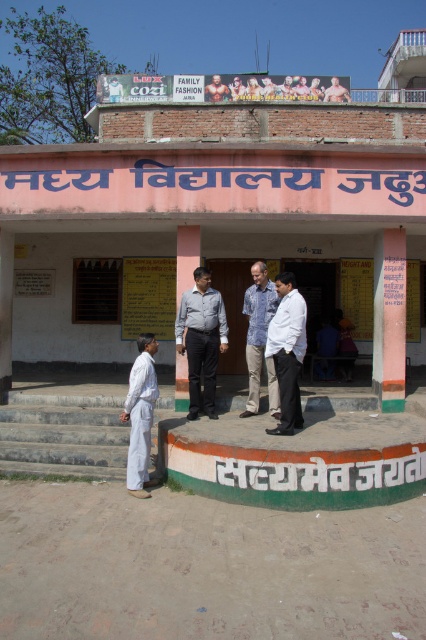
Question: Among these points, which one is farthest from the camera?

Choices:
 (A) (2, 170)
 (B) (146, 364)
 (C) (176, 394)
 (D) (261, 292)

Answer: (A)

Question: Can you confirm if orange painted pillar at right is positioned to the left of blue cotton shirt at center?

Choices:
 (A) no
 (B) yes

Answer: (A)

Question: Does light gray shirt at center appear on the right side of white cotton shirt at lower left?

Choices:
 (A) yes
 (B) no

Answer: (A)

Question: Which point appears farthest from the camera in this image?

Choices:
 (A) (278, 308)
 (B) (181, 342)
 (C) (270, 388)
 (D) (400, 227)

Answer: (D)

Question: Which of the following is the closest to the observer?

Choices:
 (A) (94, 252)
 (B) (132, 467)

Answer: (B)

Question: Is orange painted pillar at right wider than matte gray pillar at center?

Choices:
 (A) yes
 (B) no

Answer: (A)